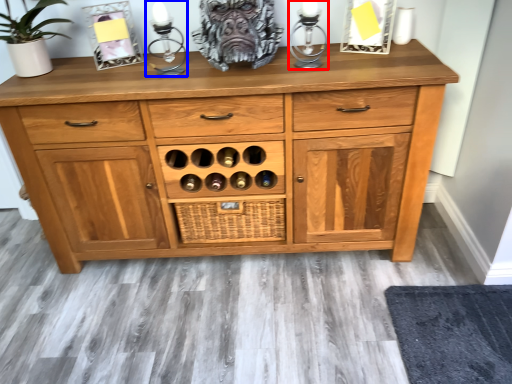
Question: Which object is closer to the camera taking this photo, candle holder (highlighted by a red box) or candle holder (highlighted by a blue box)?

Choices:
 (A) candle holder
 (B) candle holder

Answer: (A)